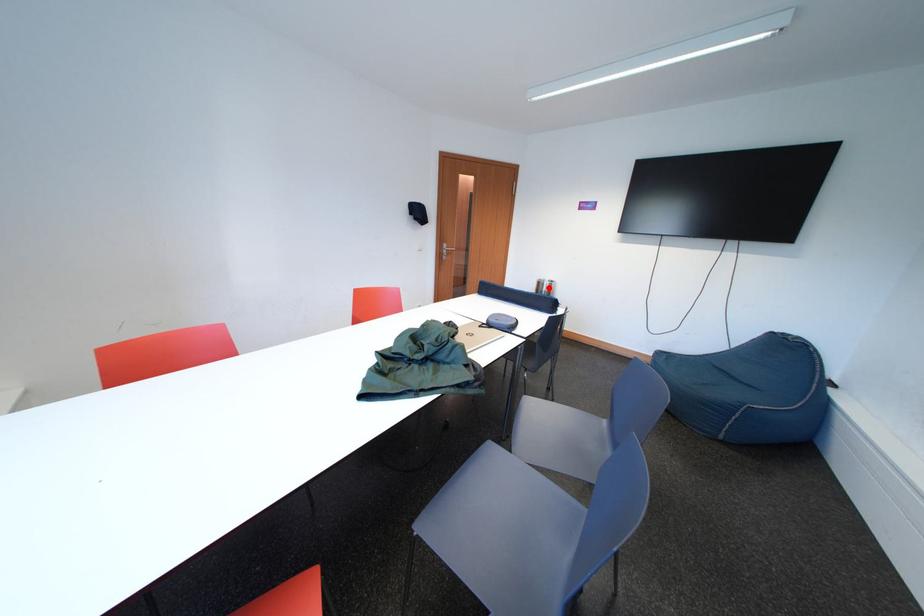
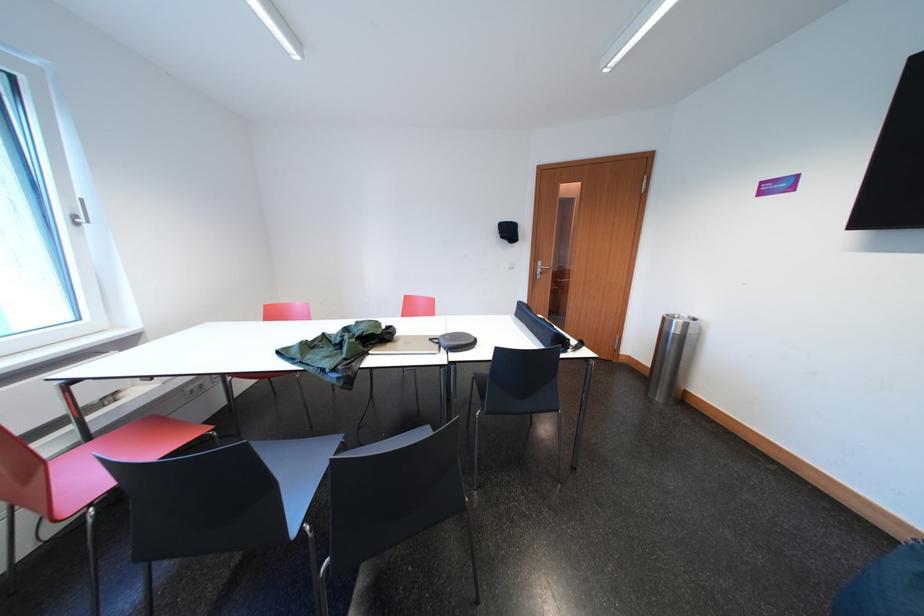
The point at the highlighted location is marked in the first image. Where is the corresponding point in the second image?

(675, 325)